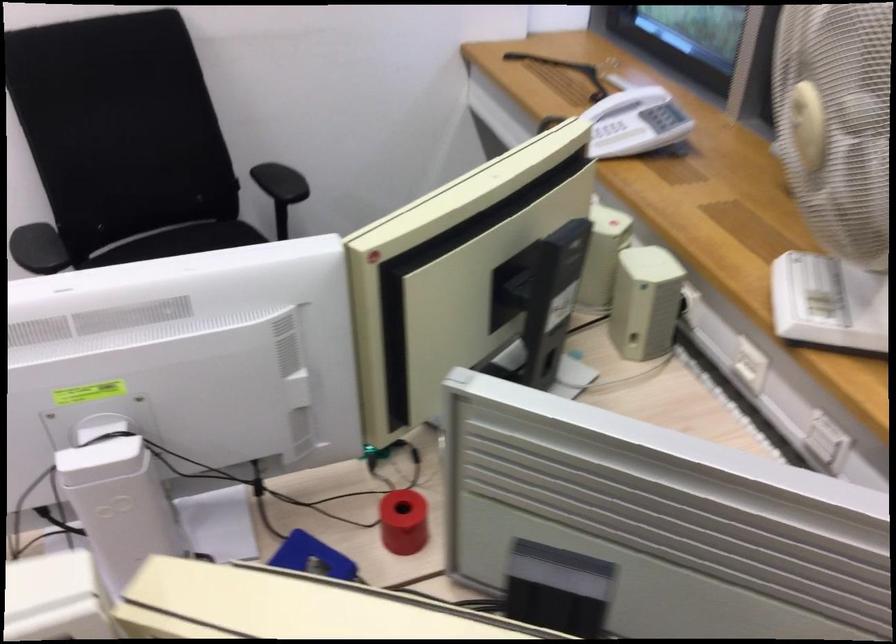
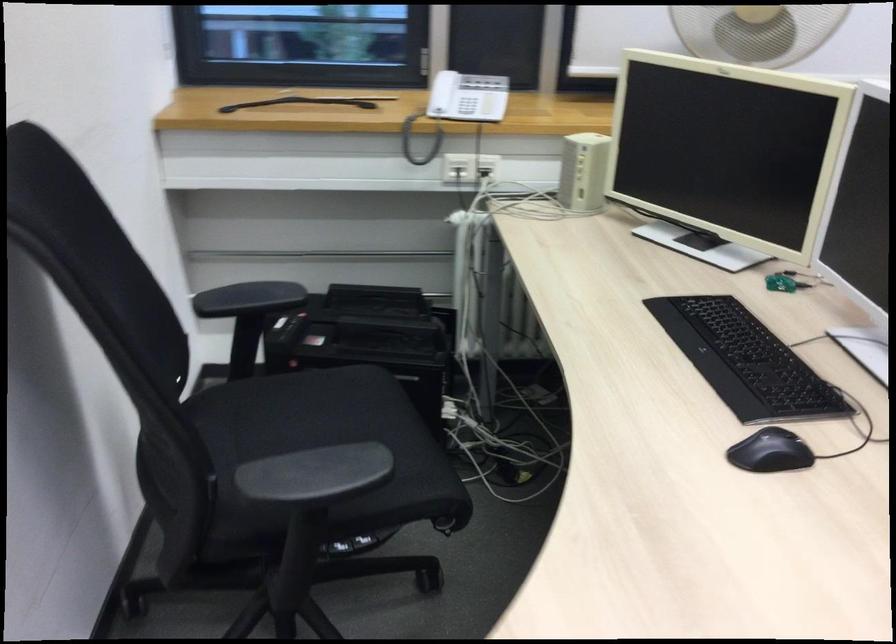
Locate, in the second image, the point that corresponds to point 618,147 in the first image.

(459, 106)